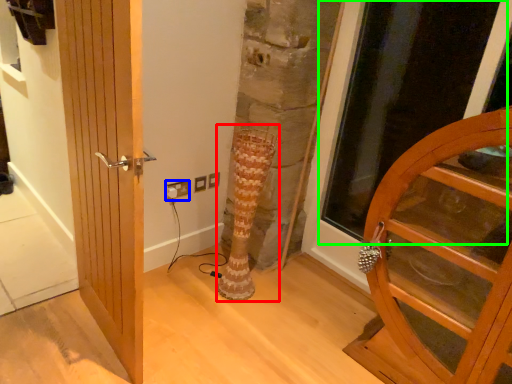
Question: Estimate the real-world distances between objects in this image. Which object is closer to tree trunk (highlighted by a red box), electric outlet (highlighted by a blue box) or glass door (highlighted by a green box)?

Choices:
 (A) electric outlet
 (B) glass door

Answer: (A)